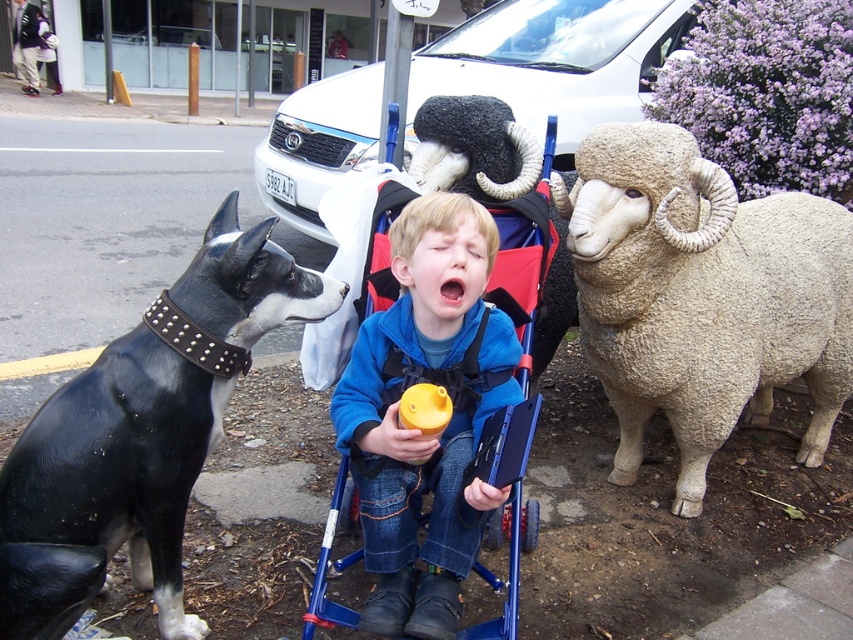
Question: Can you confirm if white woolen sheep at right is bigger than black leather dog at left?

Choices:
 (A) yes
 (B) no

Answer: (A)

Question: Which object is the closest to the blue fleece jacket at center?

Choices:
 (A) black leather dog at left
 (B) white woolen sheep at right

Answer: (A)

Question: Which object is the closest to the black leather dog at left?

Choices:
 (A) white woolen sheep at right
 (B) blue fleece jacket at center

Answer: (B)

Question: Does white woolen sheep at right appear on the right side of blue fleece jacket at center?

Choices:
 (A) no
 (B) yes

Answer: (B)

Question: Which object appears farthest from the camera in this image?

Choices:
 (A) black leather dog at left
 (B) white woolen sheep at right

Answer: (B)

Question: Can you confirm if black leather dog at left is positioned to the left of blue fleece jacket at center?

Choices:
 (A) yes
 (B) no

Answer: (A)